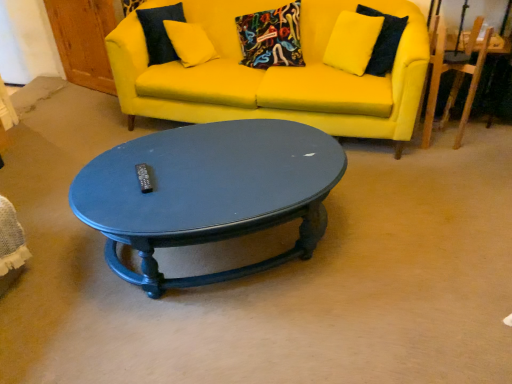
Locate an element on the screen. This screenshot has width=512, height=384. vacant space underneath wooden armchair at right (from a real-world perspective) is located at coordinates coord(442,138).